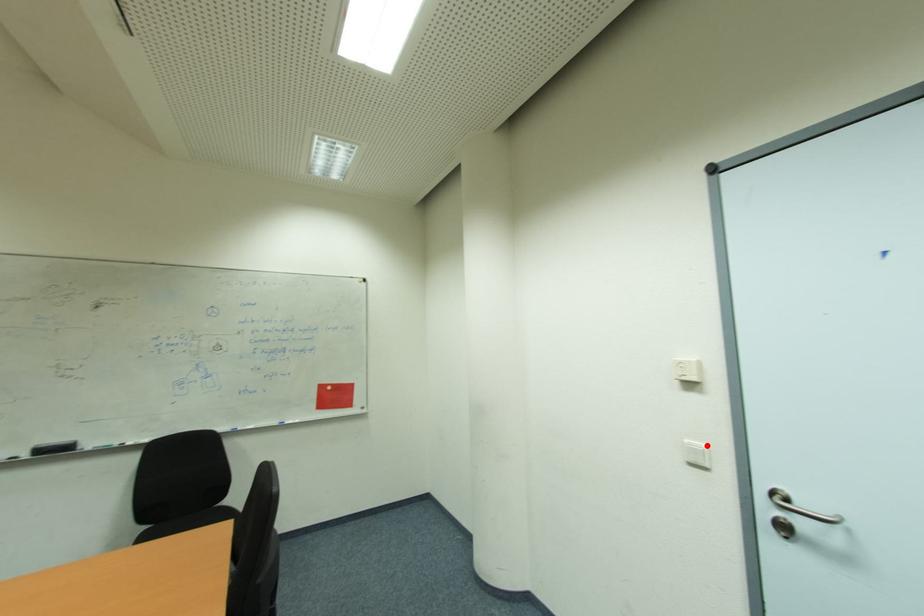
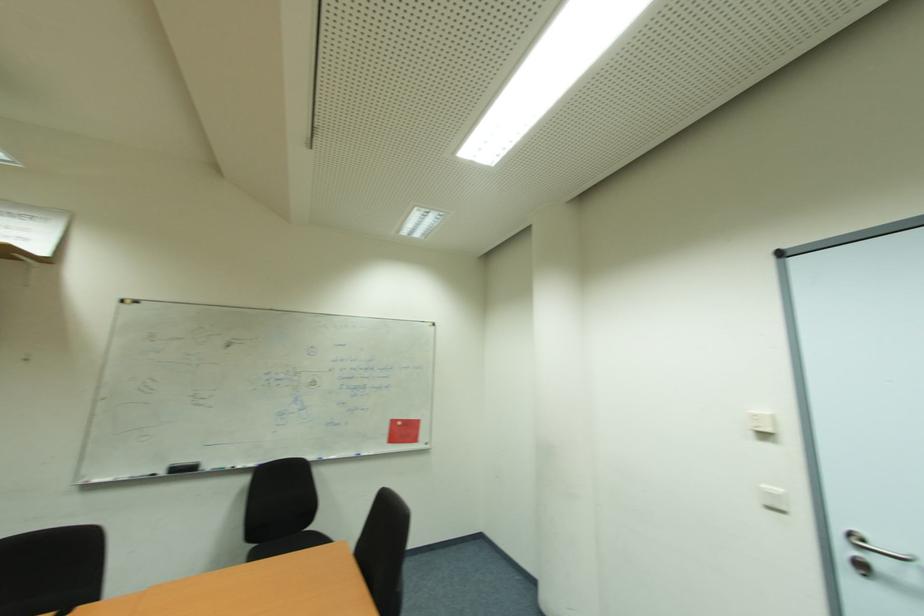
Find the pixel in the second image that matches the highlighted location in the first image.

(784, 492)